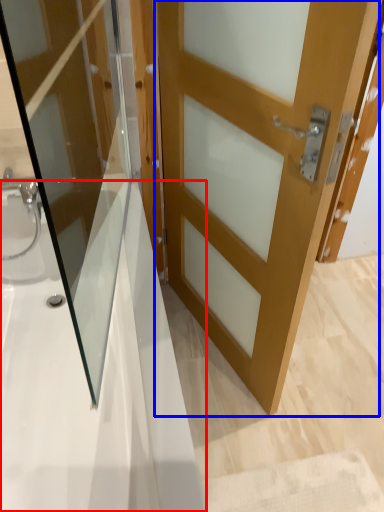
Question: Which of the following is the farthest to the observer, bath (highlighted by a red box) or door (highlighted by a blue box)?

Choices:
 (A) bath
 (B) door

Answer: (B)